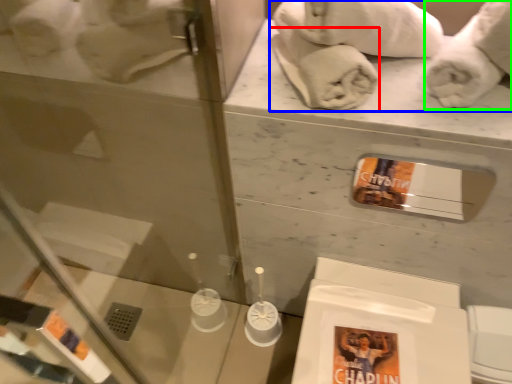
Question: Based on their relative distances, which object is farther from bath towel (highlighted by a red box)? Choose from bath towel (highlighted by a blue box) and bath towel (highlighted by a green box).

Choices:
 (A) bath towel
 (B) bath towel

Answer: (B)